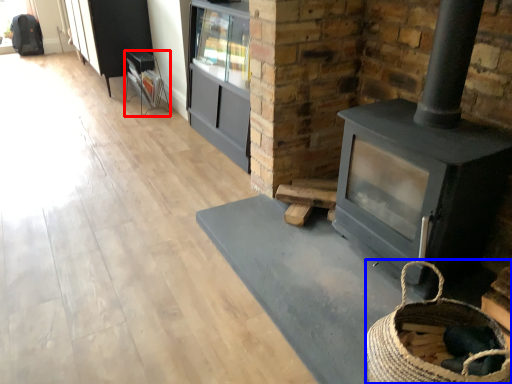
Question: Which point is further to the camera, furniture (highlighted by a red box) or basket (highlighted by a blue box)?

Choices:
 (A) furniture
 (B) basket

Answer: (A)